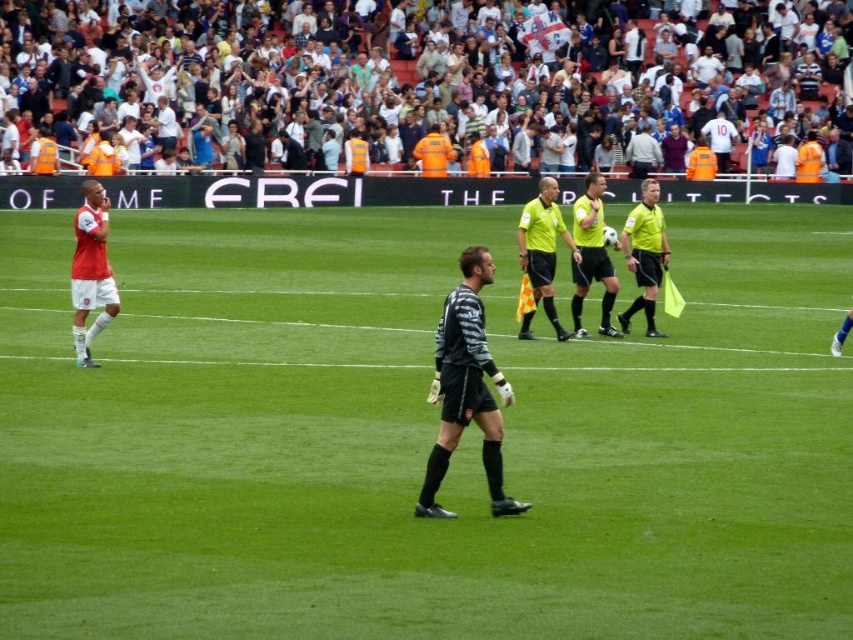
Is the position of yellow fluorescent uniform at center less distant than that of yellow/green/yellow uniform at center?

Yes, it is.

Who is taller, yellow fluorescent uniform at center or yellow/green/yellow uniform at center?

Standing taller between the two is yellow fluorescent uniform at center.

You are a GUI agent. You are given a task and a screenshot of the screen. Output one action in this format:
    pyautogui.click(x=<x>, y=<y>)
    Task: Click on the yellow fluorescent uniform at center
    
    Given the screenshot: What is the action you would take?
    pyautogui.click(x=610, y=260)

The height and width of the screenshot is (640, 853). What do you see at coordinates (91, 269) in the screenshot?
I see `matte red jersey at left` at bounding box center [91, 269].

Can you confirm if matte red jersey at left is wider than yellow/green/yellow uniform at center?

Indeed, matte red jersey at left has a greater width compared to yellow/green/yellow uniform at center.

Is point (74, 330) positioned after point (531, 225)?

No, it is in front of (531, 225).

Identify the location of matte red jersey at left. (91, 269).

Between point (770, 611) and point (97, 285), which one is positioned in front?

Positioned in front is point (770, 611).

Can you confirm if black matte referee at center is wider than matte red jersey at left?

Correct, the width of black matte referee at center exceeds that of matte red jersey at left.

Is point (332, 237) closer to viewer compared to point (108, 292)?

No, (332, 237) is behind (108, 292).

Image resolution: width=853 pixels, height=640 pixels. I want to click on black matte referee at center, so click(419, 436).